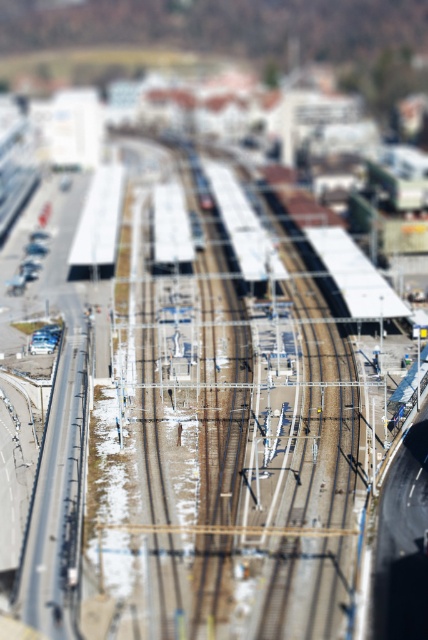
Which is behind, point (244, 264) or point (109, 244)?

The point (109, 244) is more distant.

This screenshot has width=428, height=640. What do you see at coordinates (243, 227) in the screenshot? I see `white metallic train at center` at bounding box center [243, 227].

You are a GUI agent. You are given a task and a screenshot of the screen. Output one action in this format:
    pyautogui.click(x=<x>, y=<y>)
    Task: Click on the white metallic train at center
    This screenshot has width=428, height=640.
    Given the screenshot: What is the action you would take?
    pyautogui.click(x=243, y=227)

Find the location of a particular element. The image size is (428, 640). white metallic train at center is located at coordinates (243, 227).